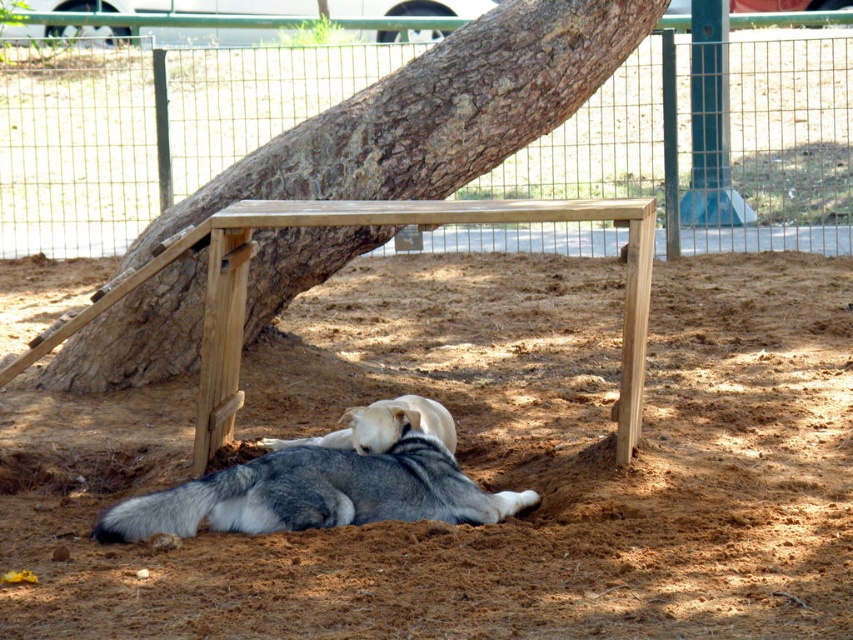
Question: Is brown sandy dirt at center positioned in front of gray fur dog at center?

Choices:
 (A) no
 (B) yes

Answer: (B)

Question: Can you confirm if gray fur dog at center is positioned below light brown fur at center?

Choices:
 (A) no
 (B) yes

Answer: (B)

Question: Which of these objects is positioned farthest from the green wire mesh at upper center?

Choices:
 (A) light brown fur at center
 (B) gray fur dog at center
 (C) brown sandy dirt at center

Answer: (C)

Question: Which is farther from the brown sandy dirt at center?

Choices:
 (A) light brown fur at center
 (B) green wire mesh at upper center

Answer: (B)

Question: Does green wire mesh at upper center have a greater width compared to gray fur dog at center?

Choices:
 (A) yes
 (B) no

Answer: (B)

Question: Which point is farther to the camera?

Choices:
 (A) light brown fur at center
 (B) brown sandy dirt at center
 (C) green wire mesh at upper center

Answer: (C)